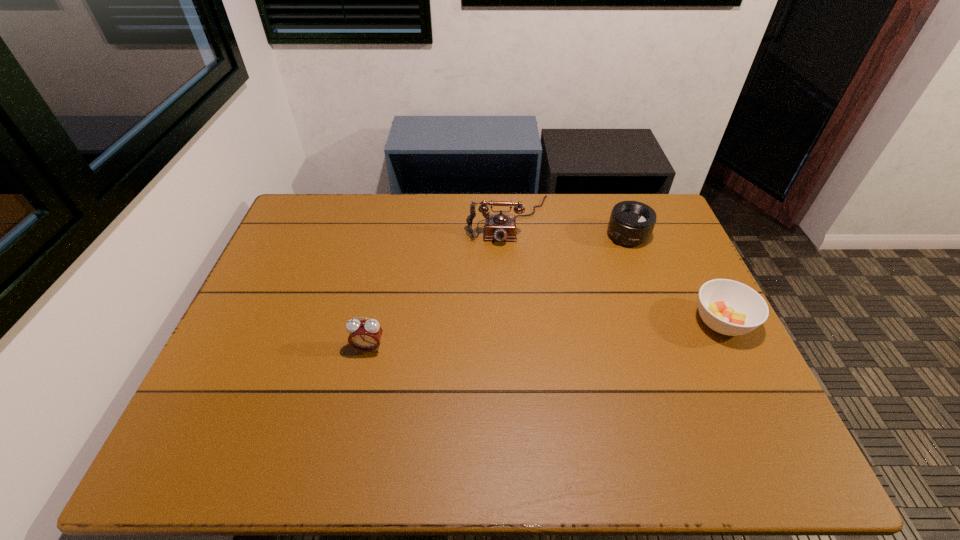
Identify the location of free space located 0.080m on the side of the second object from right to left with brand markings and control switches. The image size is (960, 540). (606, 259).

Where is `vacant area situated on the side of the second object from right to left with brand markings and control switches`? vacant area situated on the side of the second object from right to left with brand markings and control switches is located at coordinates (596, 269).

Where is `telephone at the far edge`? This screenshot has height=540, width=960. telephone at the far edge is located at coordinates (500, 227).

The width and height of the screenshot is (960, 540). I want to click on telephoto lens at the far edge, so click(x=631, y=223).

Identify the location of soup bowl situated at the right edge. (728, 307).

Identify the location of telephoto lens at the right edge. (x=631, y=223).

You are a GUI agent. You are given a task and a screenshot of the screen. Output one action in this format:
    pyautogui.click(x=<x>, y=<y>)
    Task: Click on the object that is at the far right corner
    
    Given the screenshot: What is the action you would take?
    pyautogui.click(x=631, y=223)

Where is `vacant space at the far edge`? Image resolution: width=960 pixels, height=540 pixels. vacant space at the far edge is located at coordinates click(548, 220).

Identify the location of free space at the near edge of the desktop. The width and height of the screenshot is (960, 540). (312, 393).

In order to click on free space at the left edge in this screenshot , I will do `click(231, 381)`.